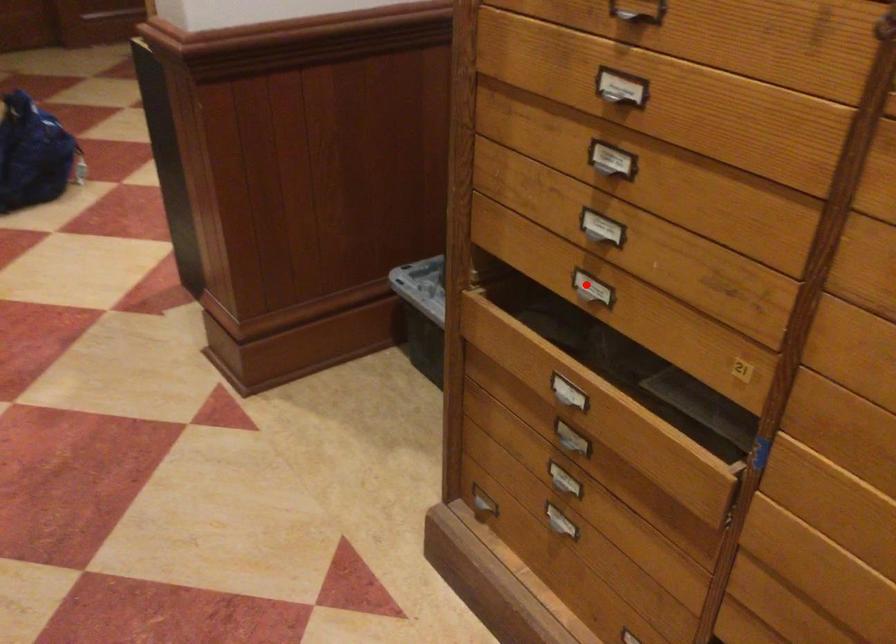
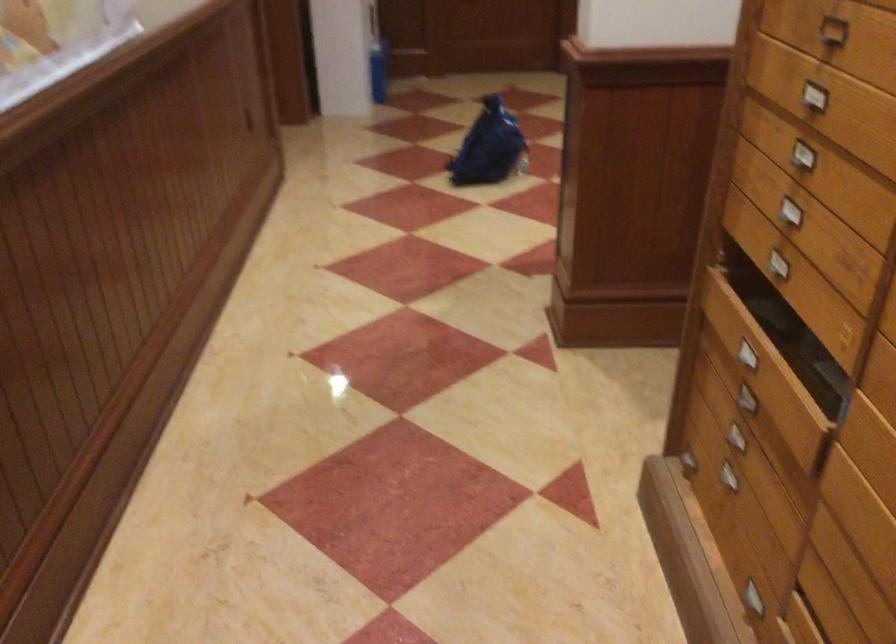
Locate, in the second image, the point that corresponds to the highlighted location in the first image.

(780, 261)